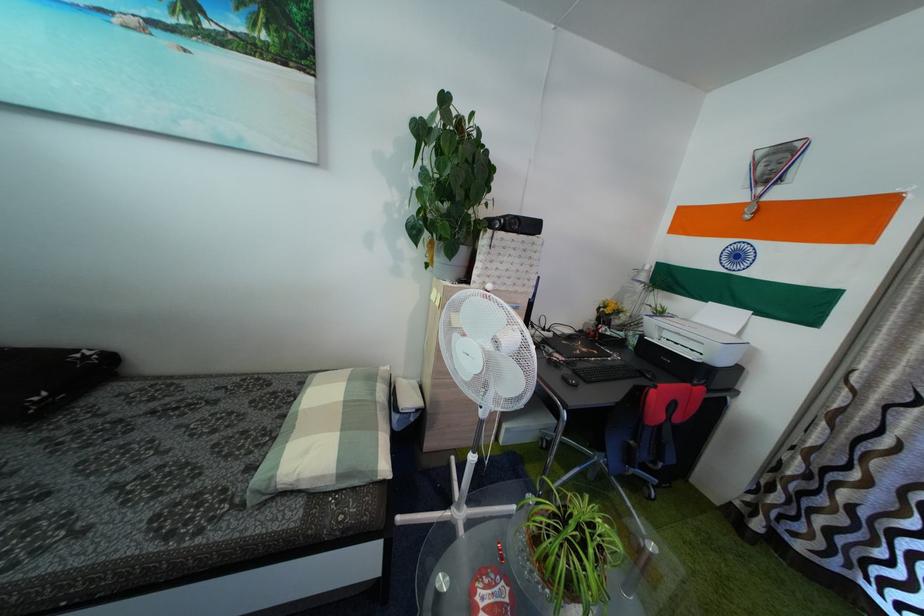
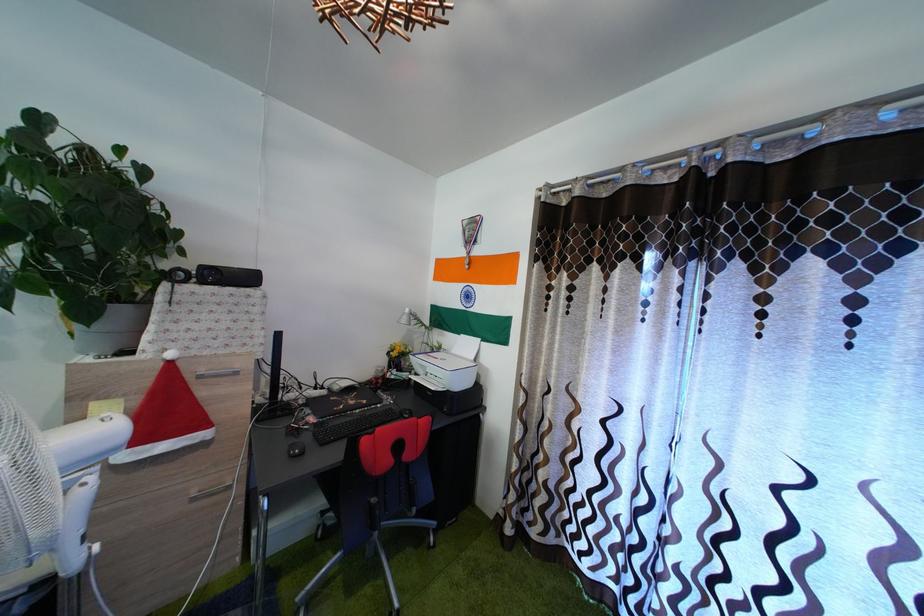
Where in the second image is the point corresponding to (471,257) from the first image?

(128, 318)